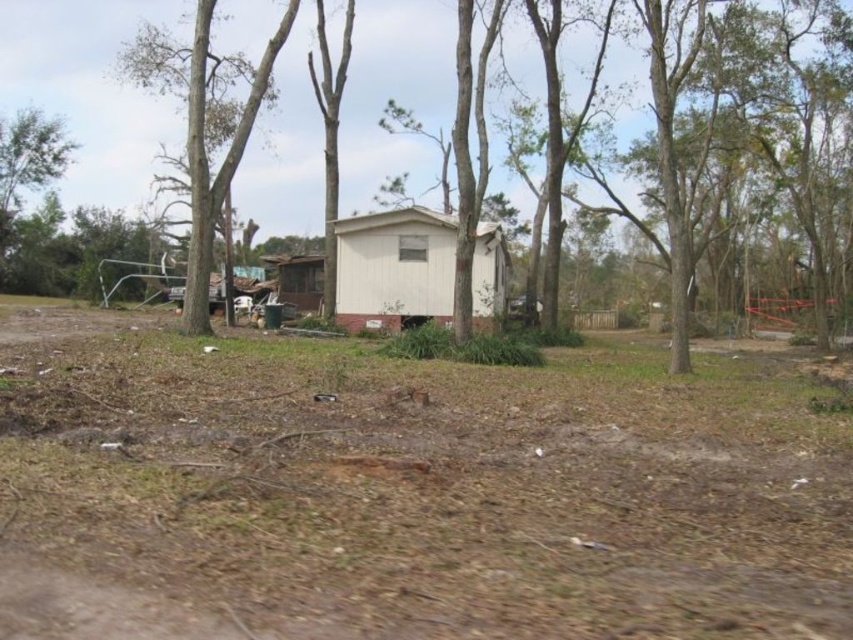
You are standing in front of the house and want to walk to the brown dirt track at center. Which direction should you head relative to the bare wood tree at center?

The brown dirt track at center is in front of the bare wood tree at center, so you should head towards the direction of the bare wood tree at center to reach the brown dirt track at center.

You are standing at the center of the image and want to find the nearest tree. Which direction should you look to find the bare wood tree at center?

The bare wood tree at center is located at point [329,138], so you should look towards the center of the image to find it.